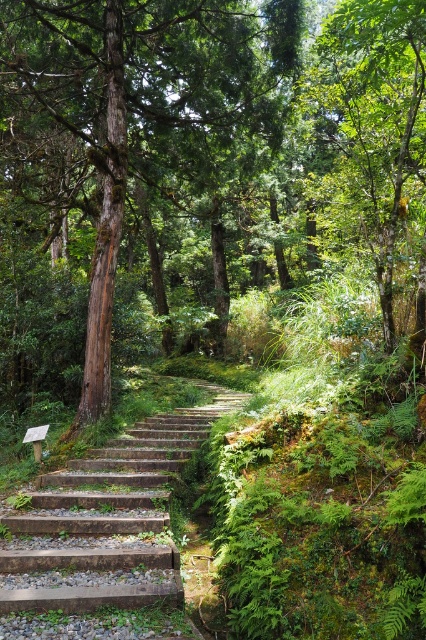
Is brown wood tree at center smaller than stone steps at center?

No.

Between brown wood tree at center and stone steps at center, which one has more height?

Standing taller between the two is brown wood tree at center.

Who is more distant from viewer, [77,388] or [69,515]?

The point [77,388] is more distant.

Identify the location of brown wood tree at center. (132, 140).

In the scene shown: Who is more distant from viewer, (36, 116) or (342, 129)?

Point (342, 129)

Does point (118, 129) lie in front of point (367, 234)?

That is False.

The height and width of the screenshot is (640, 426). In order to click on brown wood tree at center in this screenshot , I will do `click(132, 140)`.

Find the location of a particular element. The height and width of the screenshot is (640, 426). brown wood tree at center is located at coordinates (132, 140).

Does stone steps at center have a smaller size compared to green leafy tree at upper center?

No.

The image size is (426, 640). What do you see at coordinates (101, 529) in the screenshot? I see `stone steps at center` at bounding box center [101, 529].

Find the location of a particular element. stone steps at center is located at coordinates (101, 529).